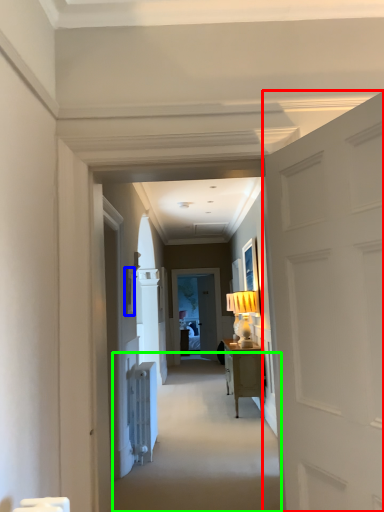
Question: Estimate the real-world distances between objects in this image. Which object is closer to door (highlighted by a red box), picture frame (highlighted by a blue box) or path (highlighted by a green box)?

Choices:
 (A) picture frame
 (B) path

Answer: (B)